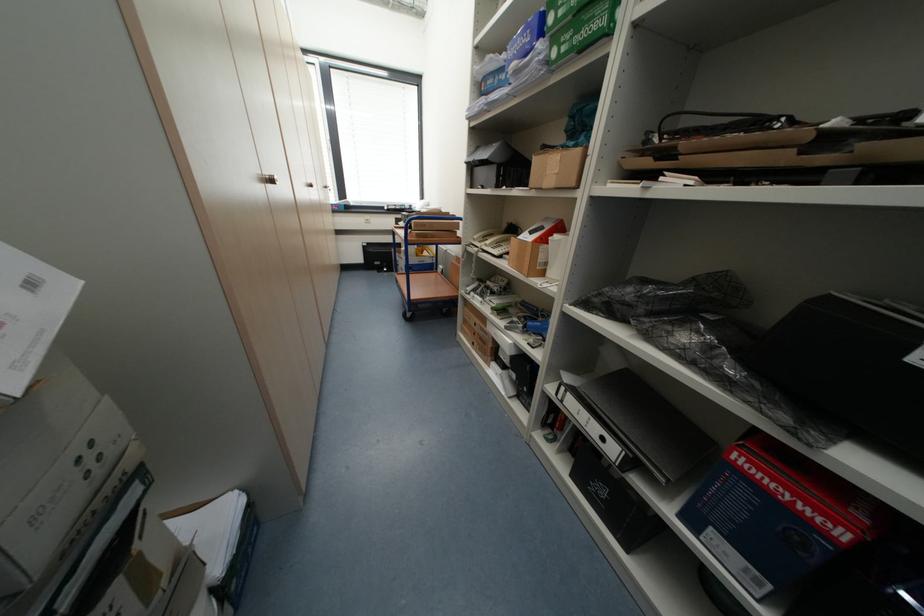
The height and width of the screenshot is (616, 924). Find the location of `utility cart handle`. utility cart handle is located at coordinates (622, 543).